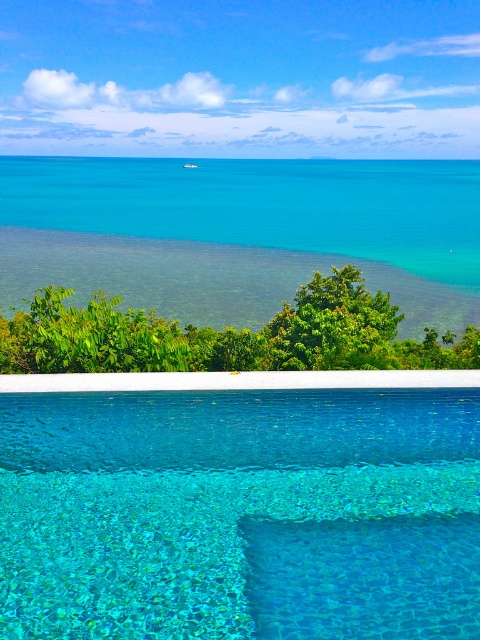
Is transparent glass pool at center positioned at the back of clear blue water at center?

No.

Does transparent glass pool at center have a lesser height compared to clear blue water at center?

Indeed, transparent glass pool at center has a lesser height compared to clear blue water at center.

Where is `transparent glass pool at center`? This screenshot has height=640, width=480. transparent glass pool at center is located at coordinates (240, 513).